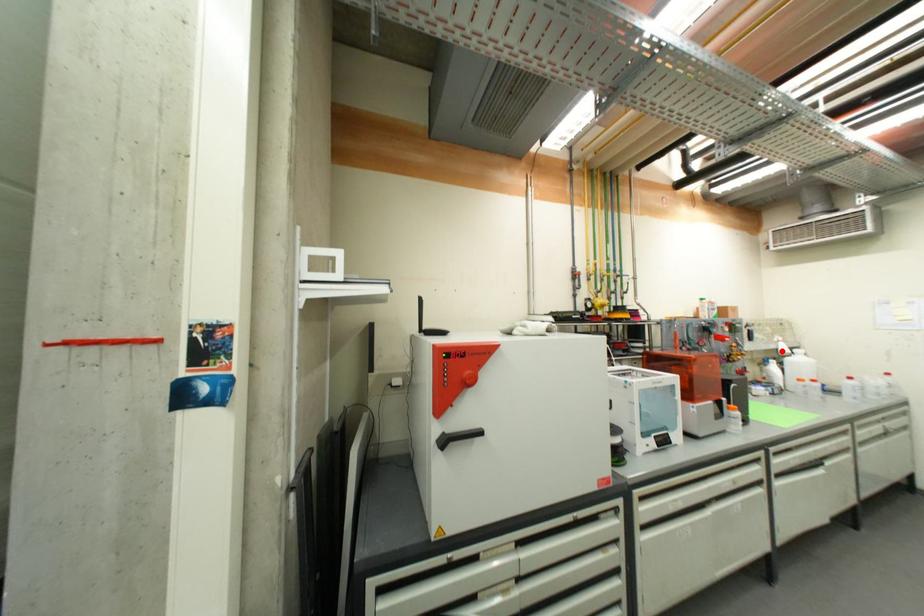
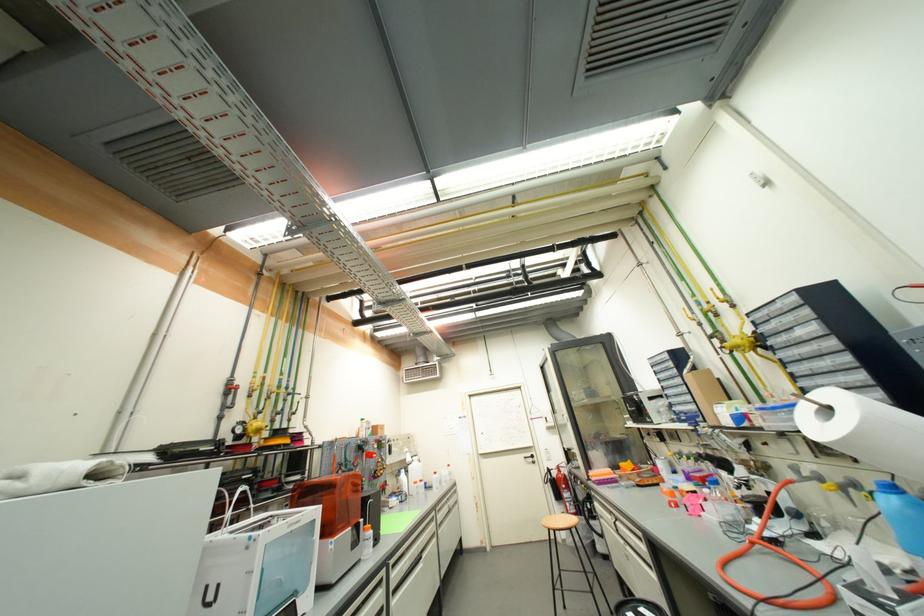
Question: I am providing you with two images of the same scene from different viewpoints. In image1, a red point is highlighted. Considering the same 3D point in image2, which of the following is correct?

Choices:
 (A) It is closer
 (B) It is farther

Answer: (B)